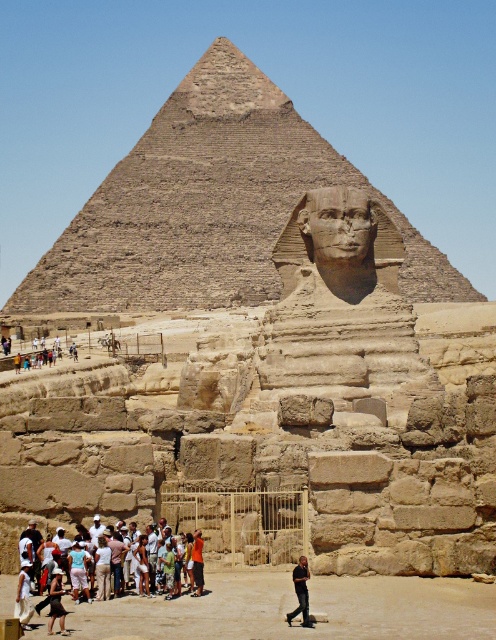
You are standing at the point labeled point (161, 189) and want to take a photo of the Great Sphinx of Giza. If your camera has a maximum zoom range of 100 meters, will you be able to capture the entire Sphinx in the photo without moving closer?

The distance between point (161, 189) and the camera is 437.91 meters. Since the camera can only zoom up to 100 meters, you will not be able to capture the entire Sphinx without moving closer.